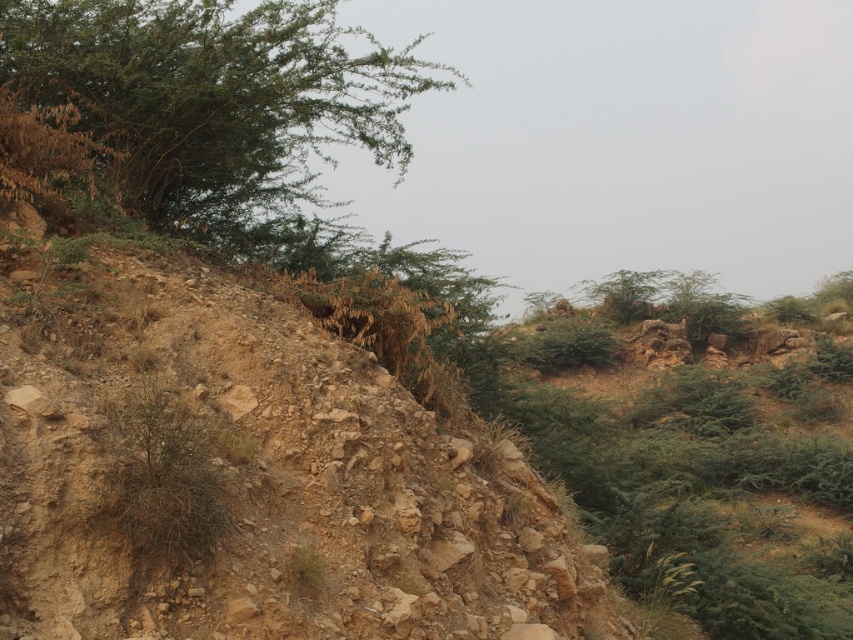
You are a hiker planning to cross the rugged, arid landscape shown in the image. You notice the dull brown dirt at center and the green leafy shrubs at upper center. Which of these two features is taller?

The green leafy shrubs at upper center are taller than the dull brown dirt at center.

Based on the photo, you are a hiker trying to navigate through the rugged, arid landscape. You notice two green leafy shrubs in the upper part of the scene. Which shrub, the green leafy shrubs at upper center or the green leafy shrub at upper left, would you estimate to have a larger width?

The green leafy shrubs at upper center might be wider than the green leafy shrub at upper left, so the shrub at upper center likely has a larger width.